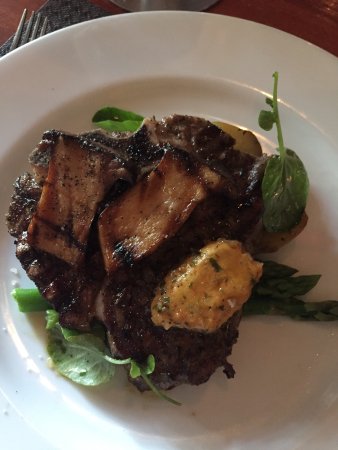
Locate an element on the screen. Image resolution: width=338 pixels, height=450 pixels. placemat is located at coordinates pyautogui.click(x=61, y=11).